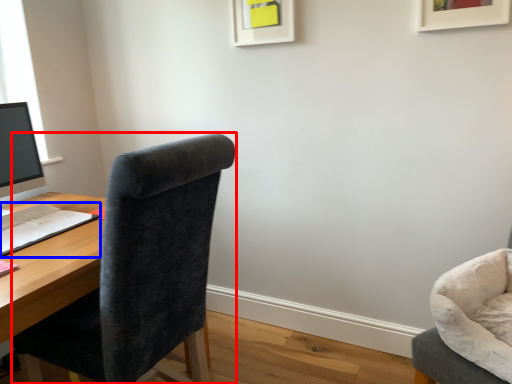
Question: Which point is closer to the camera, chair (highlighted by a red box) or notepad (highlighted by a blue box)?

Choices:
 (A) chair
 (B) notepad

Answer: (A)